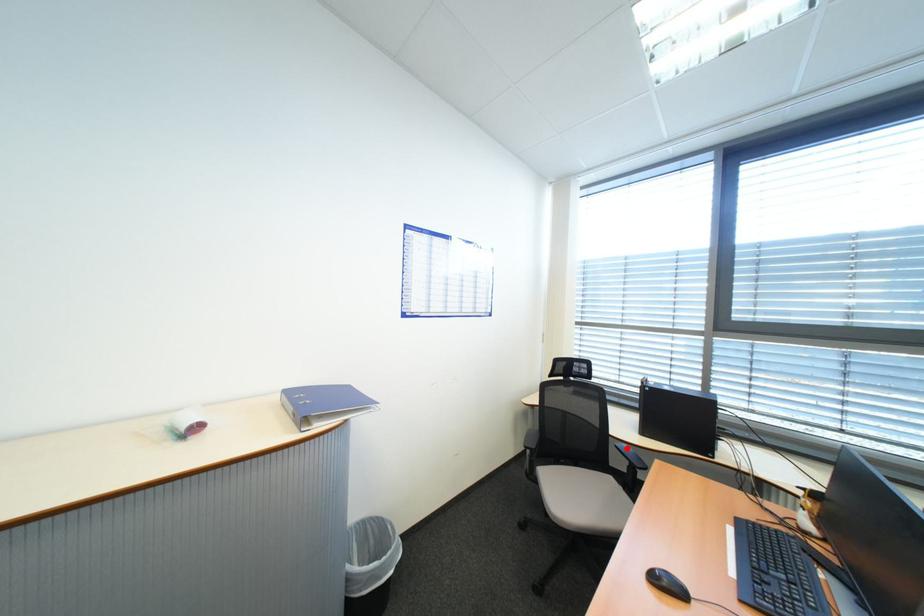
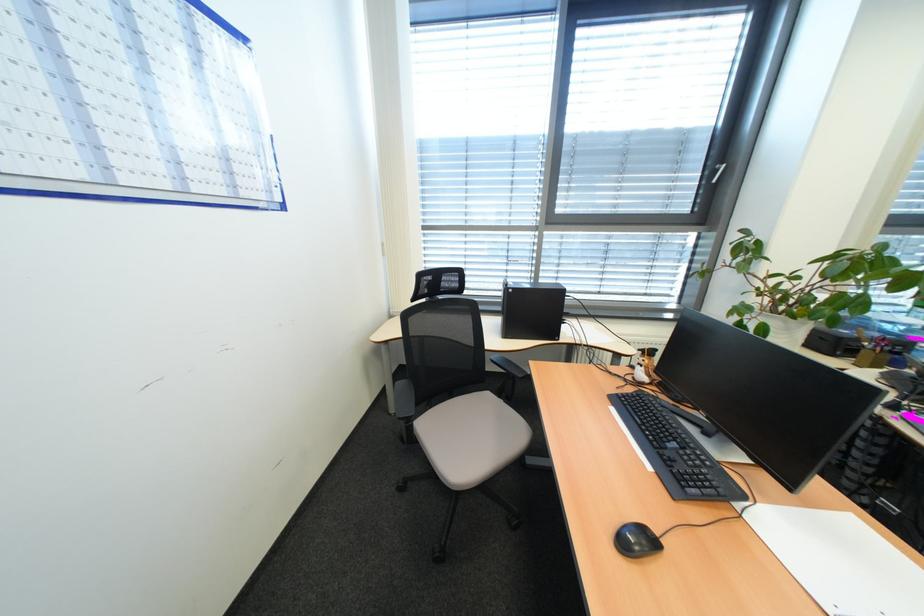
Find the pixel in the second image that matches the highlighted location in the first image.

(503, 362)